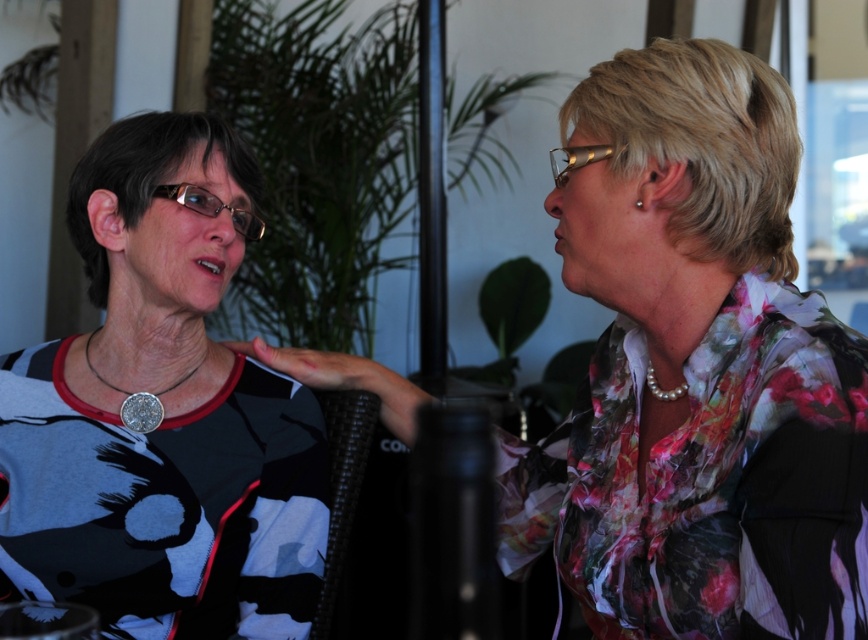
Question: Which point is closer to the camera taking this photo?

Choices:
 (A) (194, 513)
 (B) (636, 148)

Answer: (B)

Question: Does floral print blouse at center come behind matte black shirt at left?

Choices:
 (A) no
 (B) yes

Answer: (A)

Question: Among these points, which one is nearest to the camera?

Choices:
 (A) (7, 390)
 (B) (607, 337)

Answer: (B)

Question: Is floral print blouse at center smaller than matte black shirt at left?

Choices:
 (A) no
 (B) yes

Answer: (A)

Question: Does floral print blouse at center appear under matte black shirt at left?

Choices:
 (A) no
 (B) yes

Answer: (A)